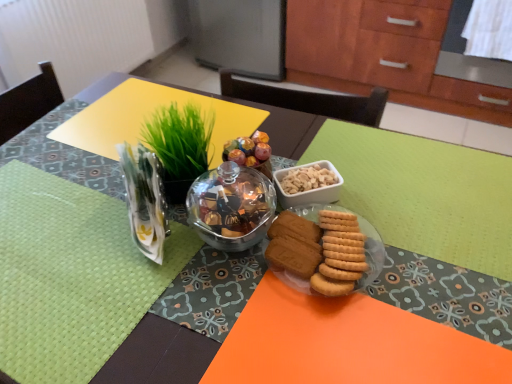
Question: Is green woven placemat at left to the right of matte glass plate at center from the viewer's perspective?

Choices:
 (A) no
 (B) yes

Answer: (A)

Question: Is green woven placemat at left closer to the viewer compared to matte glass plate at center?

Choices:
 (A) no
 (B) yes

Answer: (B)

Question: Can you confirm if green woven placemat at left is wider than matte glass plate at center?

Choices:
 (A) no
 (B) yes

Answer: (B)

Question: Is green woven placemat at left taller than matte glass plate at center?

Choices:
 (A) yes
 (B) no

Answer: (B)

Question: From the image's perspective, is green woven placemat at left on matte glass plate at center?

Choices:
 (A) no
 (B) yes

Answer: (A)

Question: Is green woven placemat at left aimed at matte glass plate at center?

Choices:
 (A) yes
 (B) no

Answer: (B)

Question: Is clear plastic vase at upper left to the left of green leafy grass at upper center from the viewer's perspective?

Choices:
 (A) no
 (B) yes

Answer: (B)

Question: From the image's perspective, is clear plastic vase at upper left on green leafy grass at upper center?

Choices:
 (A) no
 (B) yes

Answer: (A)

Question: Does clear plastic vase at upper left have a lesser width compared to green leafy grass at upper center?

Choices:
 (A) no
 (B) yes

Answer: (B)

Question: Is clear plastic vase at upper left oriented away from green leafy grass at upper center?

Choices:
 (A) no
 (B) yes

Answer: (B)

Question: Is clear plastic vase at upper left smaller than green leafy grass at upper center?

Choices:
 (A) no
 (B) yes

Answer: (A)

Question: Is clear plastic vase at upper left located outside green leafy grass at upper center?

Choices:
 (A) yes
 (B) no

Answer: (A)

Question: Are clear plastic vase at upper left and matte glass bowl at center located far from each other?

Choices:
 (A) no
 (B) yes

Answer: (A)